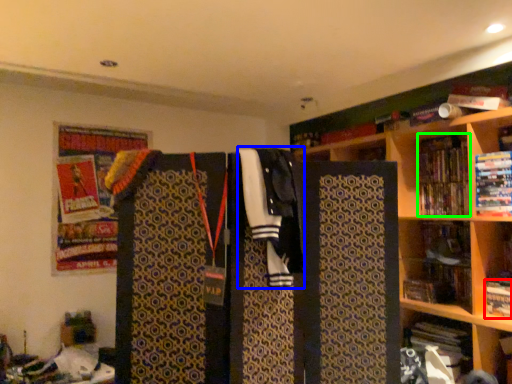
Question: Which object is positioned closest to book (highlighted by a red box)? Select from clothing (highlighted by a blue box) and book (highlighted by a green box).

Choices:
 (A) clothing
 (B) book

Answer: (B)